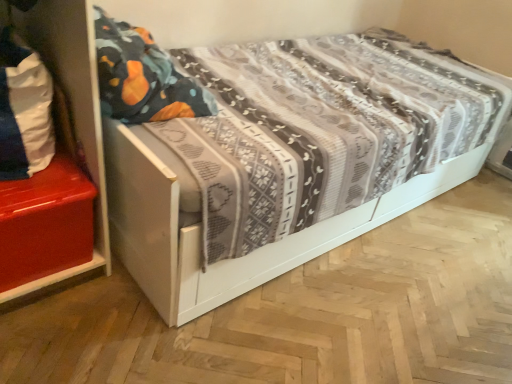
Question: Can we say shiny red chest at left lies outside white fabric pillow at left?

Choices:
 (A) no
 (B) yes

Answer: (B)

Question: Is shiny red chest at left behind white fabric pillow at left?

Choices:
 (A) yes
 (B) no

Answer: (A)

Question: From the image's perspective, is shiny red chest at left under white fabric pillow at left?

Choices:
 (A) yes
 (B) no

Answer: (A)

Question: Does shiny red chest at left have a lesser height compared to white fabric pillow at left?

Choices:
 (A) yes
 (B) no

Answer: (A)

Question: Does shiny red chest at left have a smaller size compared to white fabric pillow at left?

Choices:
 (A) no
 (B) yes

Answer: (A)

Question: Considering their positions, is white fabric pillow at left located in front of or behind white wood bed at center?

Choices:
 (A) front
 (B) behind

Answer: (B)

Question: Considering the relative positions of white fabric pillow at left and white wood bed at center in the image provided, is white fabric pillow at left to the left or to the right of white wood bed at center?

Choices:
 (A) right
 (B) left

Answer: (B)

Question: From a real-world perspective, relative to white wood bed at center, is white fabric pillow at left vertically above or below?

Choices:
 (A) below
 (B) above

Answer: (B)

Question: Is point (27, 102) closer or farther from the camera than point (465, 8)?

Choices:
 (A) closer
 (B) farther

Answer: (A)

Question: Is point (64, 268) closer or farther from the camera than point (488, 14)?

Choices:
 (A) closer
 (B) farther

Answer: (A)

Question: Is shiny red chest at left inside the boundaries of white wood bed at center, or outside?

Choices:
 (A) outside
 (B) inside

Answer: (A)

Question: Looking at their shapes, would you say shiny red chest at left is wider or thinner than white wood bed at center?

Choices:
 (A) thin
 (B) wide

Answer: (A)

Question: From their relative heights in the image, would you say shiny red chest at left is taller or shorter than white wood bed at center?

Choices:
 (A) short
 (B) tall

Answer: (A)

Question: Is point (183, 231) positioned closer to the camera than point (14, 124)?

Choices:
 (A) closer
 (B) farther

Answer: (A)

Question: Is white wood bed at center taller or shorter than white fabric pillow at left?

Choices:
 (A) tall
 (B) short

Answer: (A)